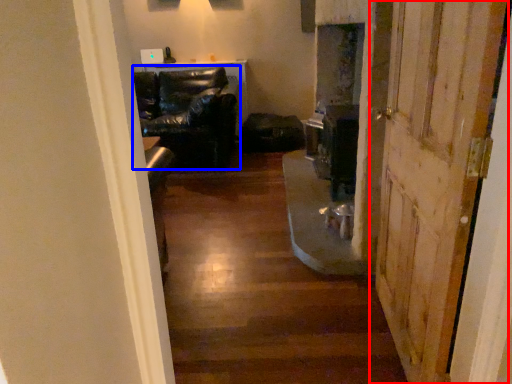
Question: Which point is closer to the camera, door (highlighted by a red box) or chair (highlighted by a blue box)?

Choices:
 (A) door
 (B) chair

Answer: (A)